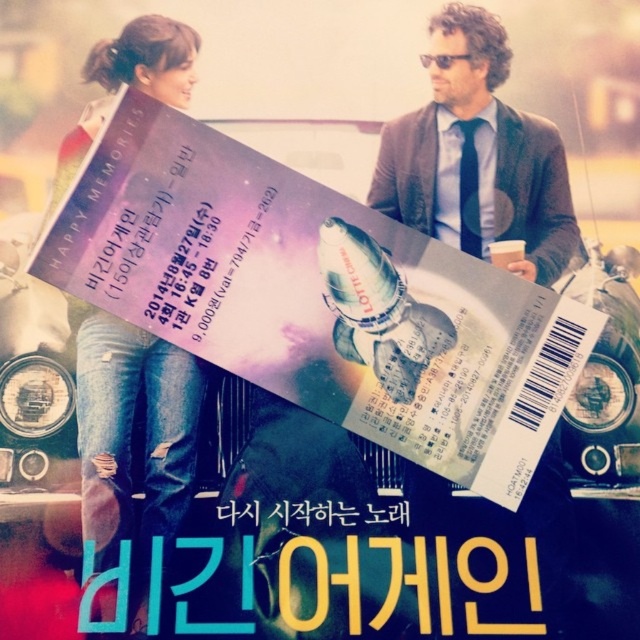
You are designing a display for a clothing store and need to arrange the jeans at left and the dark gray sweater at upper right. Based on their sizes, which item should be placed higher on the rack to ensure visibility?

The jeans at left has a greater height compared to the dark gray sweater at upper right, so placing the jeans higher on the rack will ensure visibility since they are taller.

You are a costume designer preparing for a scene where the characters need to wear outfits that match their personalities. The jeans at left belong to a character who values comfort and practicality, while the dark gray sweater at upper right is for someone who prefers a more formal look. Given their sizes, which outfit would require more fabric to produce?

The jeans at left require more fabric to produce because they have a larger size compared to the dark gray sweater at upper right.

You are a moviegoer who wants to find the person wearing the dark gray sweater at upper right in the poster. Which direction should you look from the jeans at left?

The jeans at left is positioned on the left side of dark gray sweater at upper right, so you should look to the right from the jeans at left to find the dark gray sweater at upper right.